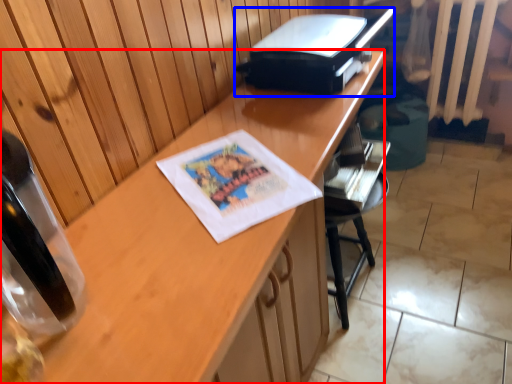
Question: Which point is closer to the camera, desk (highlighted by a red box) or printer (highlighted by a blue box)?

Choices:
 (A) desk
 (B) printer

Answer: (A)